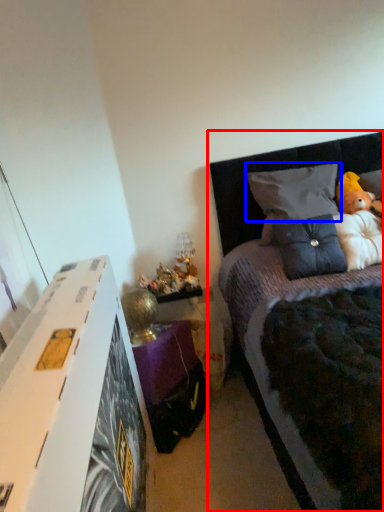
Question: Which of the following is the closest to the observer, bed (highlighted by a red box) or pillow (highlighted by a blue box)?

Choices:
 (A) bed
 (B) pillow

Answer: (A)